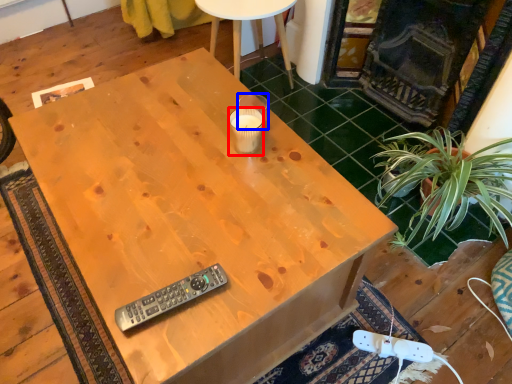
Question: Which point is further to the camera, coffee cup (highlighted by a red box) or coffee cup (highlighted by a blue box)?

Choices:
 (A) coffee cup
 (B) coffee cup

Answer: (B)